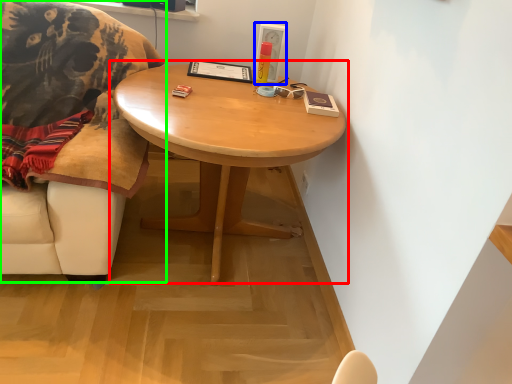
Question: Which object is positioned closest to coffee table (highlighted by a red box)? Select from picture frame (highlighted by a blue box) and chair (highlighted by a green box).

Choices:
 (A) picture frame
 (B) chair

Answer: (B)